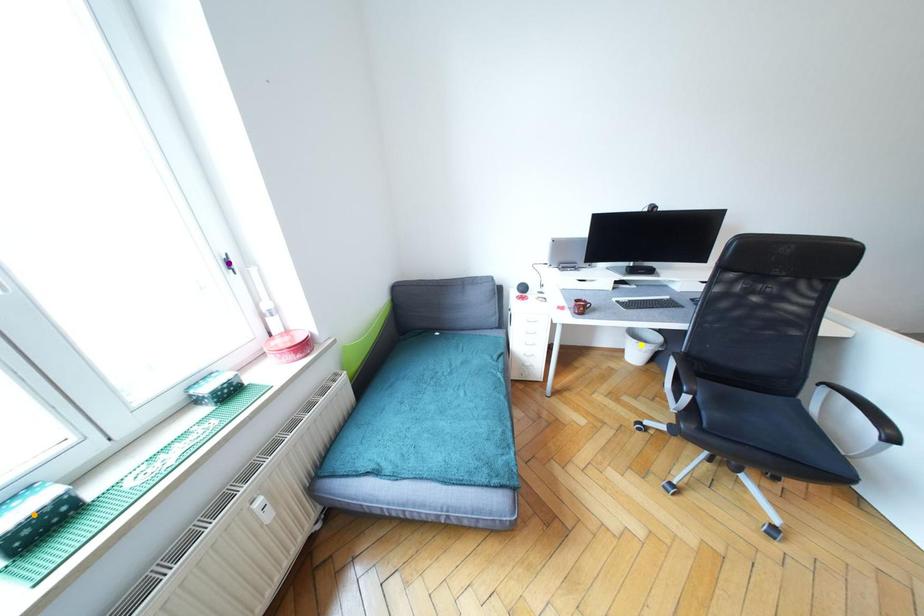
Order these from nearest to farthest:
purple point, orange point, yellow point

orange point
purple point
yellow point